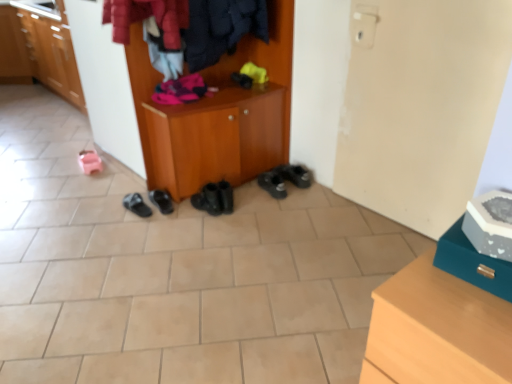
Locate an element on the screen. Image resolution: width=512 pixels, height=384 pixels. free space that is to the left of wooden cabinet at center, which is counted as the second cabinetry, starting from the top is located at coordinates (99, 201).